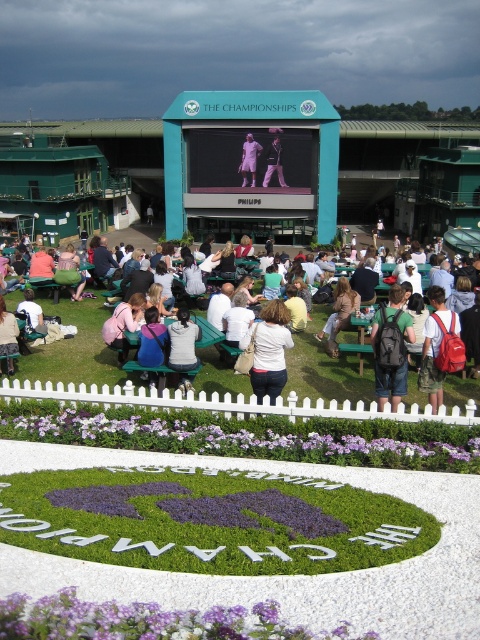
Question: Where is light brown leather bag at center located in relation to denim jacket at lower left in the image?

Choices:
 (A) left
 (B) right

Answer: (B)

Question: Does matte black backpack at center have a greater width compared to light brown leather jacket at center?

Choices:
 (A) yes
 (B) no

Answer: (B)

Question: Which object is farther from the camera taking this photo?

Choices:
 (A) matte black backpack at center
 (B) purple leafy plant at lower center
 (C) red backpack at center

Answer: (C)

Question: Which point appears closest to the camera in this image?

Choices:
 (A) (10, 339)
 (B) (445, 310)
 (C) (241, 180)
 (D) (266, 182)

Answer: (B)

Question: Which point is farther to the camera?

Choices:
 (A) purple matte flower at lower center
 (B) white cotton shirt at center
 (C) light brown leather bag at center

Answer: (C)

Question: Is purple matte flower at lower center to the left of red backpack at center from the viewer's perspective?

Choices:
 (A) yes
 (B) no

Answer: (A)